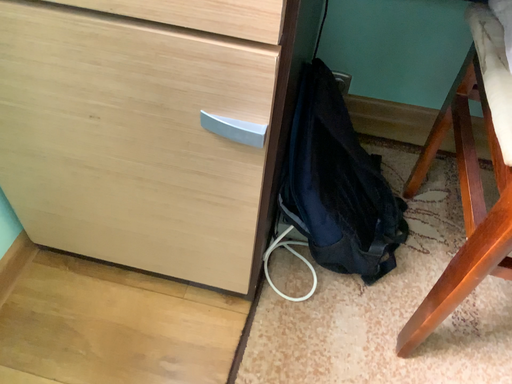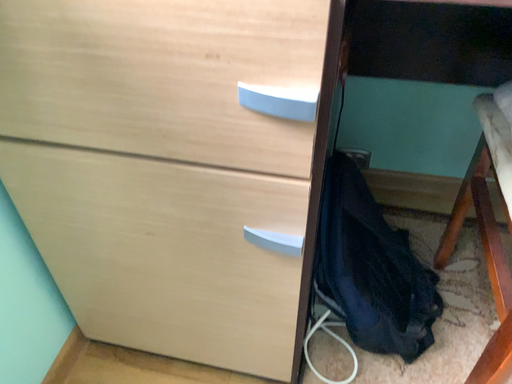
Question: How did the camera likely rotate when shooting the video?

Choices:
 (A) rotated upward
 (B) rotated downward

Answer: (A)